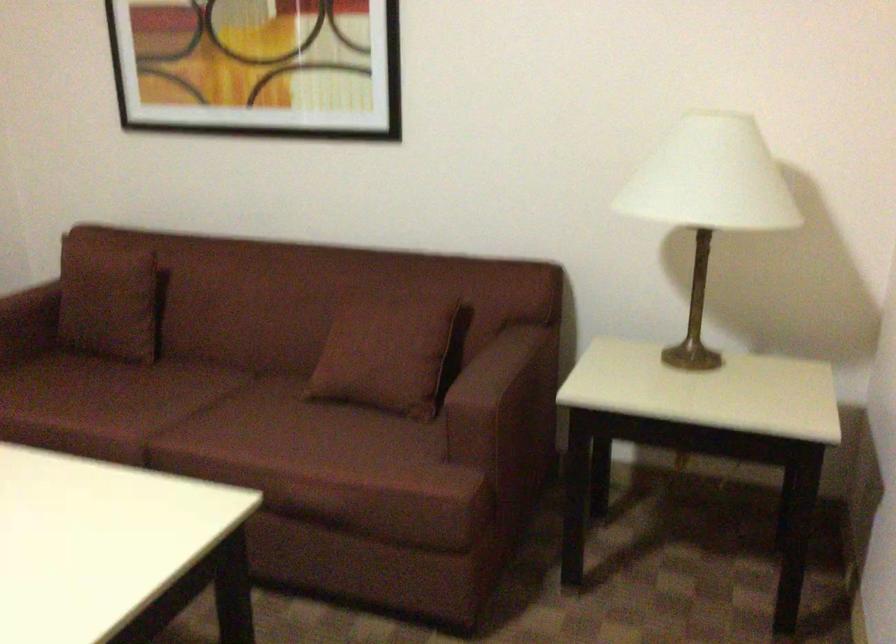
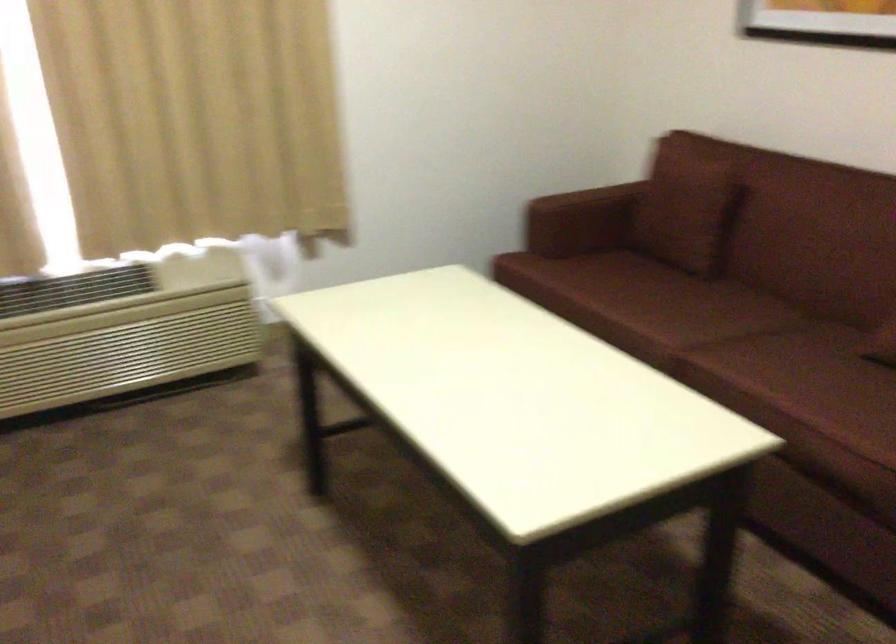
In the second image, find the point that corresponds to point (145, 402) in the first image.

(682, 310)